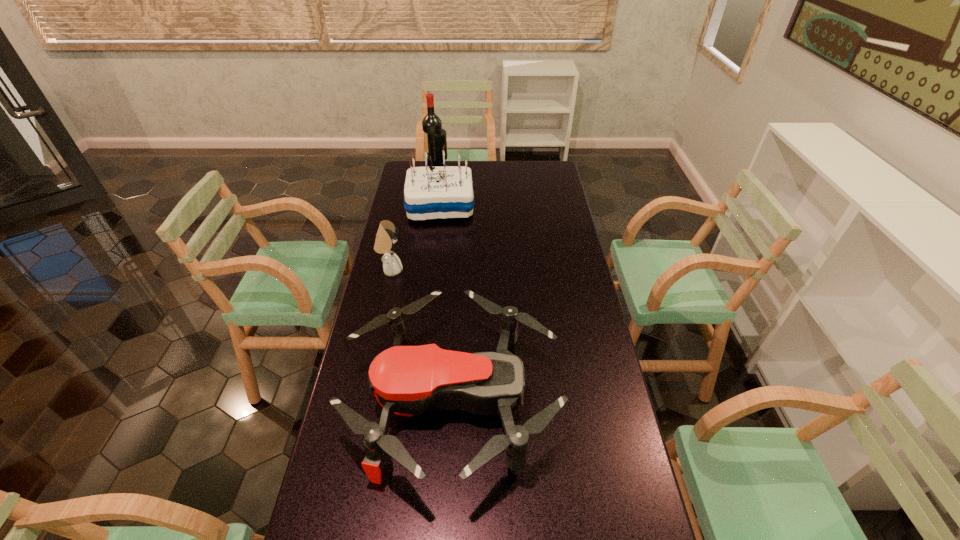
I want to click on free spot at the far right corner of the desktop, so click(x=556, y=163).

The width and height of the screenshot is (960, 540). What are the coordinates of `vacant region between the drone and the wine bottle` in the screenshot? It's located at (445, 284).

The width and height of the screenshot is (960, 540). I want to click on vacant space in between the third nearest object and the nearest object, so click(x=446, y=303).

The width and height of the screenshot is (960, 540). What are the coordinates of `unoccupied area between the doll and the nearest object` in the screenshot? It's located at (421, 336).

You are a GUI agent. You are given a task and a screenshot of the screen. Output one action in this format:
    pyautogui.click(x=<x>, y=<y>)
    Task: Click on the vacant area between the drone and the second nearest object
    The height and width of the screenshot is (540, 960).
    Given the screenshot: What is the action you would take?
    pyautogui.click(x=421, y=336)

Locate an element on the screen. This screenshot has height=540, width=960. object that is the third nearest to the nearest object is located at coordinates (431, 124).

Identify which object is the third closest to the third farthest object. Please provide its 2D coordinates. Your answer should be formatted as a tuple, i.e. [(x, y)], where the tuple contains the x and y coordinates of a point satisfying the conditions above.

[(431, 124)]